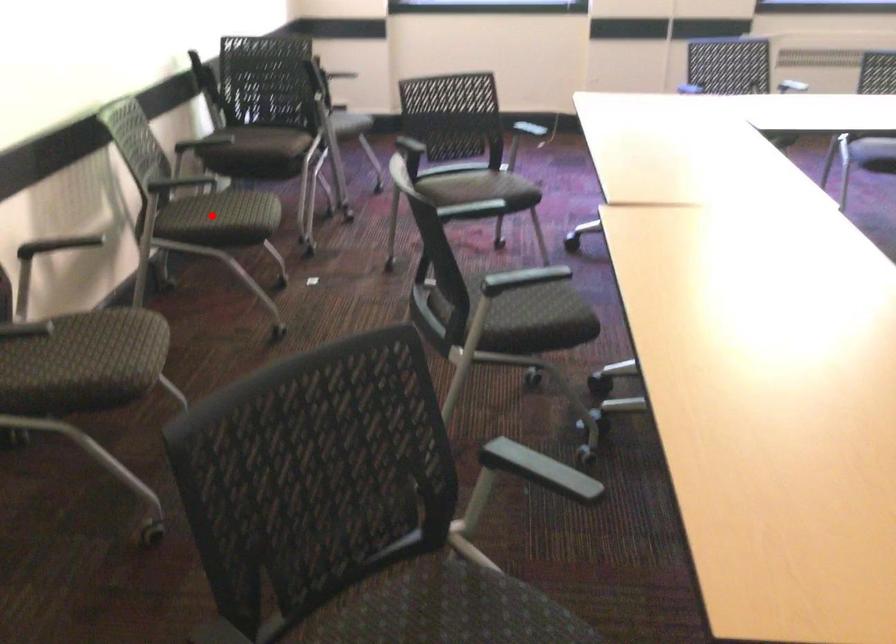
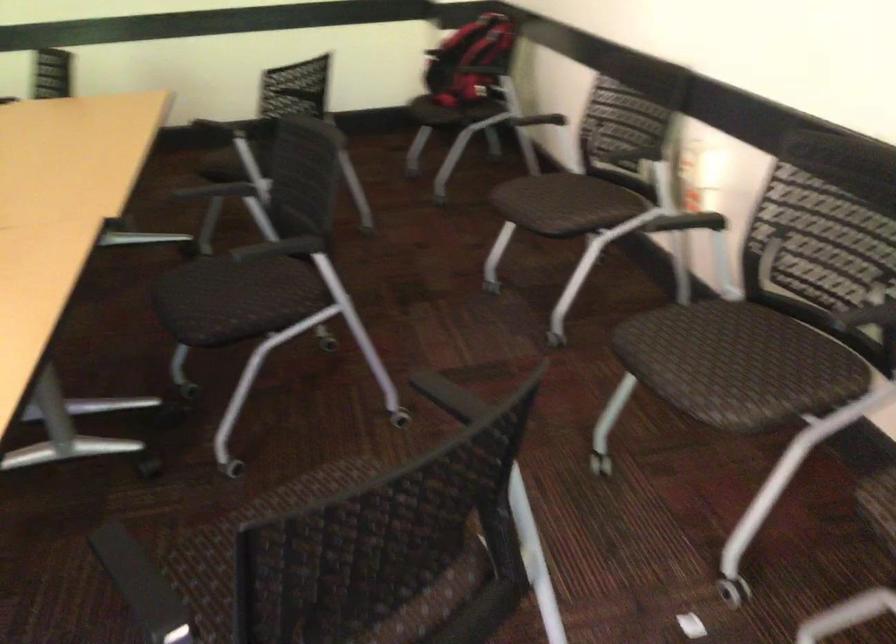
Question: I am providing you with two images of the same scene from different viewpoints. A red point is shown in image1. For the corresponding object point in image2, is it positioned nearer or farther from the camera?

Choices:
 (A) Nearer
 (B) Farther

Answer: (A)